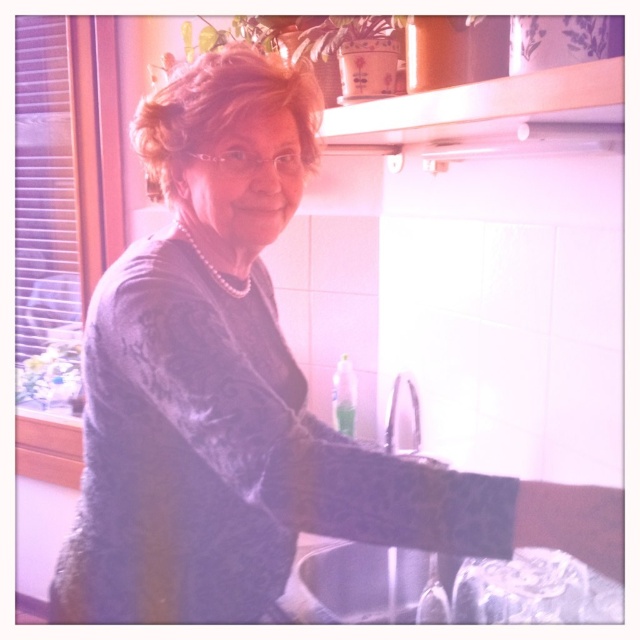
Question: Is matte gray sweater at center positioned behind black matte sink at lower center?

Choices:
 (A) yes
 (B) no

Answer: (B)

Question: Which point appears farthest from the camera in this image?

Choices:
 (A) (365, 609)
 (B) (413, 401)

Answer: (B)

Question: Is black matte sink at lower center closer to camera compared to white glossy faucet at upper center?

Choices:
 (A) no
 (B) yes

Answer: (B)

Question: Which point is farther to the camera?

Choices:
 (A) (374, 589)
 (B) (396, 397)
 (C) (74, 605)

Answer: (B)

Question: Can you confirm if matte gray sweater at center is positioned below black matte sink at lower center?

Choices:
 (A) no
 (B) yes

Answer: (A)

Question: Among these points, which one is farthest from the camera?

Choices:
 (A) (408, 593)
 (B) (394, 444)
 (C) (166, 621)

Answer: (B)